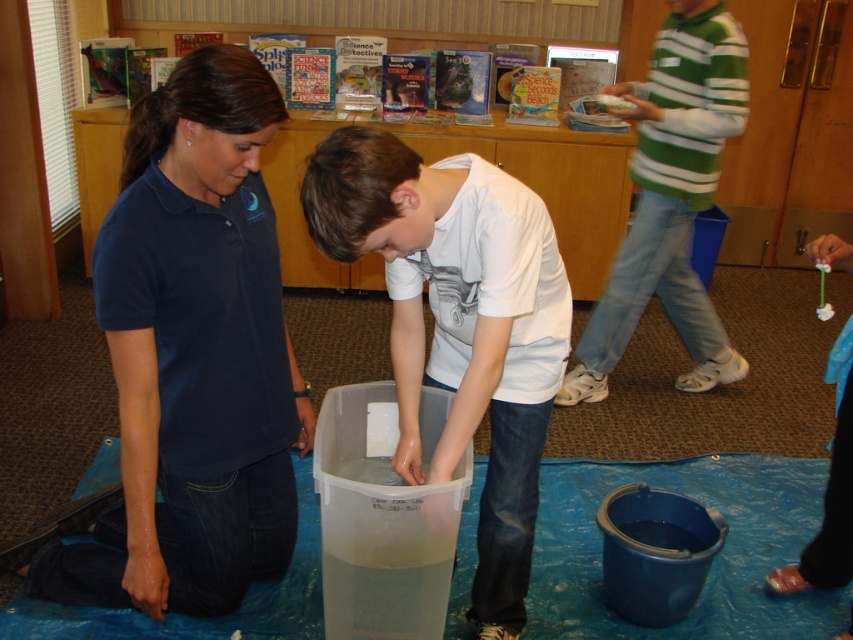
You are a photographer trying to capture a candid shot of the dark blue cotton shirt at center and the green striped sweater at upper right in the scene. Since you want both subjects to be in focus, you need to adjust your camera settings based on their heights. Which subject should you focus on first to ensure proper depth of field?

The dark blue cotton shirt at center is shorter than the green striped sweater at upper right. To ensure both are in focus, you should focus on the taller subject, the green striped sweater at upper right, as depth of field typically extends more behind the point of focus than in front.

In the scene shown: You are a photographer standing at the entrance of the room. You want to take a photo of the dark blue cotton shirt at center and the green striped sweater at upper right so that both are clearly visible in the frame. Based on their distance, is it possible to capture both in a single shot without moving the camera?

The dark blue cotton shirt at center and green striped sweater at upper right are 5.19 feet apart. Since the distance between them is manageable within a standard camera frame, it is possible to capture both in a single shot without moving the camera.

You are a photographer trying to capture a candid shot of the white matte shirt at center and the green striped sweater at upper right. Since you want both subjects to be in focus, you need to know which one is closer to the camera. Can you determine which is nearer based on their positions?

The white matte shirt at center has a lesser height compared to green striped sweater at upper right, which indicates that the white matte shirt at center is closer to the camera.